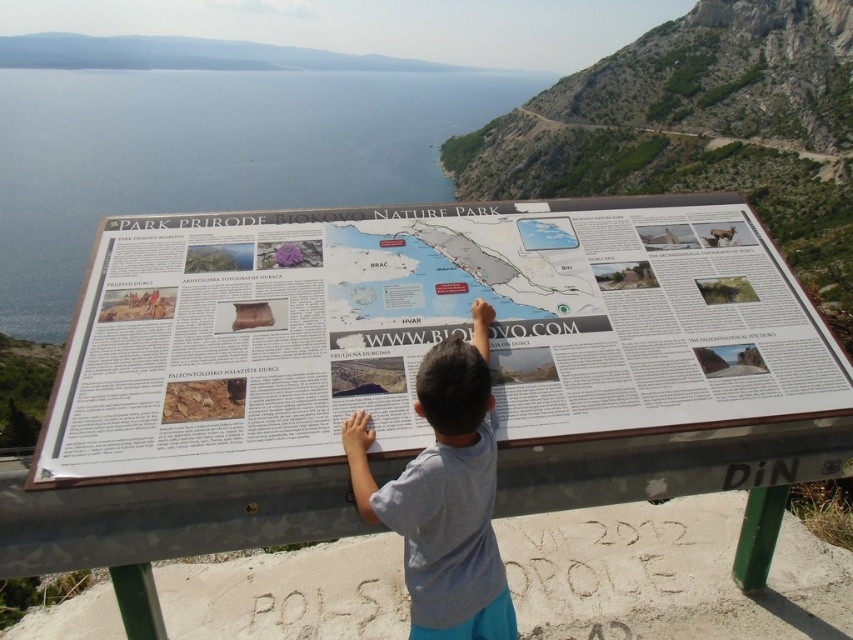
You are a hiker trying to determine which object on the informational board is wider. You see the white plastic map at center and the gray cotton shirt at center. Which one has a greater width?

The white plastic map at center has a greater width than the gray cotton shirt at center, as stated in the description.